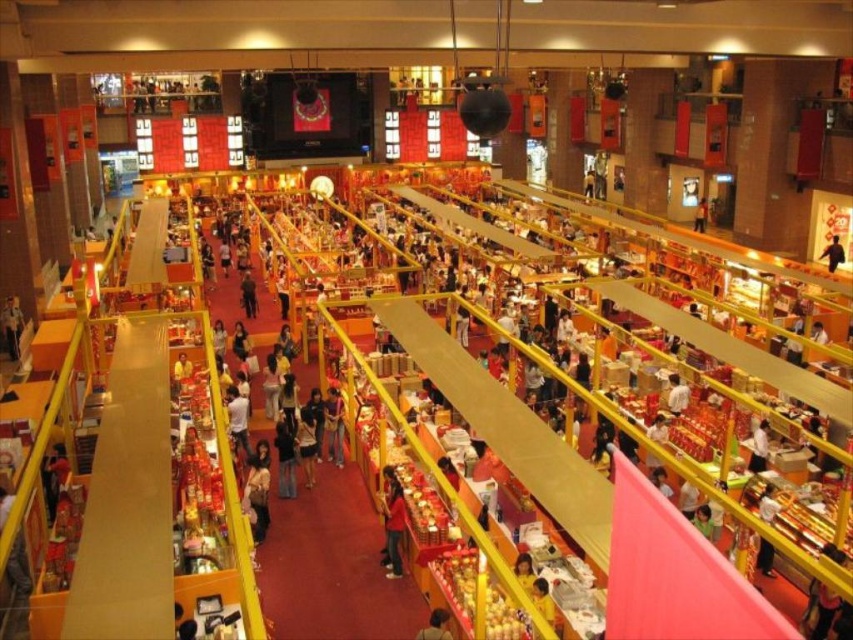
You are a customer looking to buy a shirt in this market. You see two shirts at the center of the stalls, a white fabric shirt at center and a white matte shirt at center. Which one is located to the right side?

The white fabric shirt at center is positioned on the right side of the white matte shirt at center.

You are a customer in the market and want to buy a shirt and a jacket. The vendor tells you that the red matte shirt at center is larger than the black leather jacket at center. Which item would you choose if you prefer a larger size?

The red matte shirt at center is bigger than the black leather jacket at center, so you should choose the red matte shirt at center if you prefer a larger size.